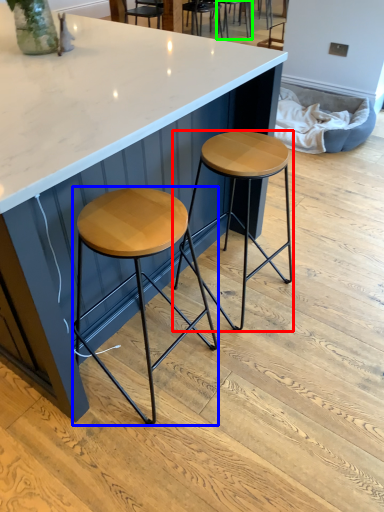
Question: Considering the real-world distances, which object is farthest from stool (highlighted by a red box)? stool (highlighted by a blue box) or chair (highlighted by a green box)?

Choices:
 (A) stool
 (B) chair

Answer: (B)